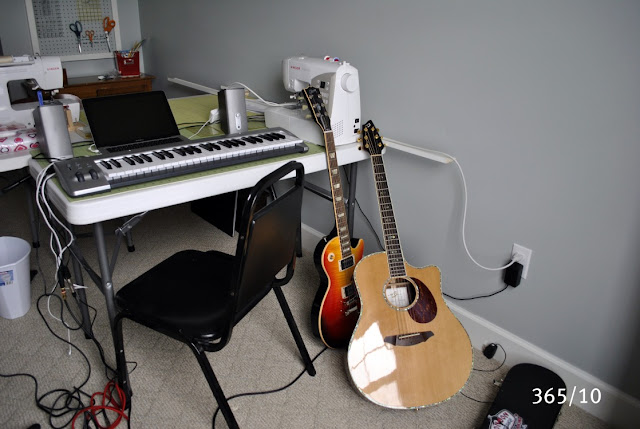
Locate an element on the screen. This screenshot has height=429, width=640. outlet is located at coordinates (518, 271).